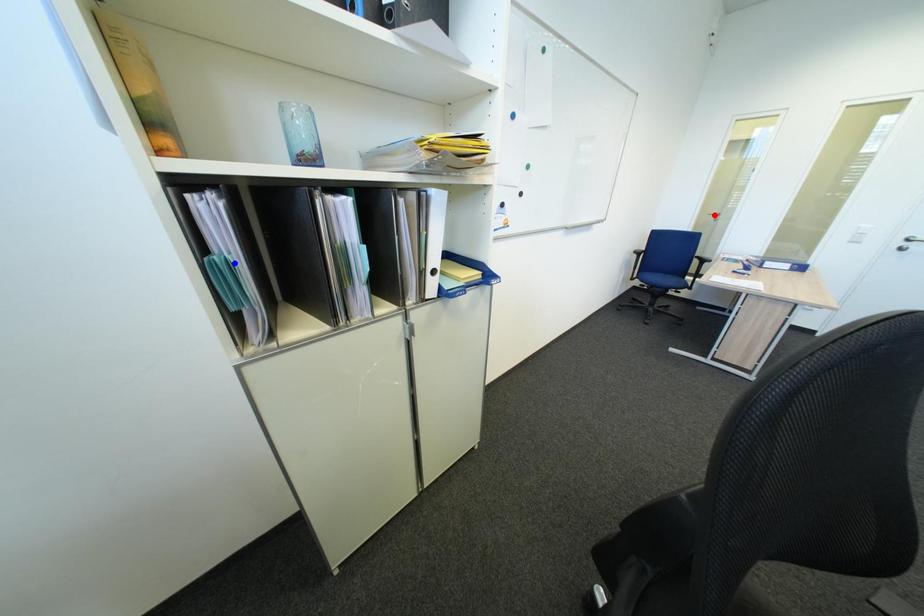
Question: Two points are marked on the image. Which point is closer to the camera?

Choices:
 (A) Blue point is closer.
 (B) Red point is closer.

Answer: (A)